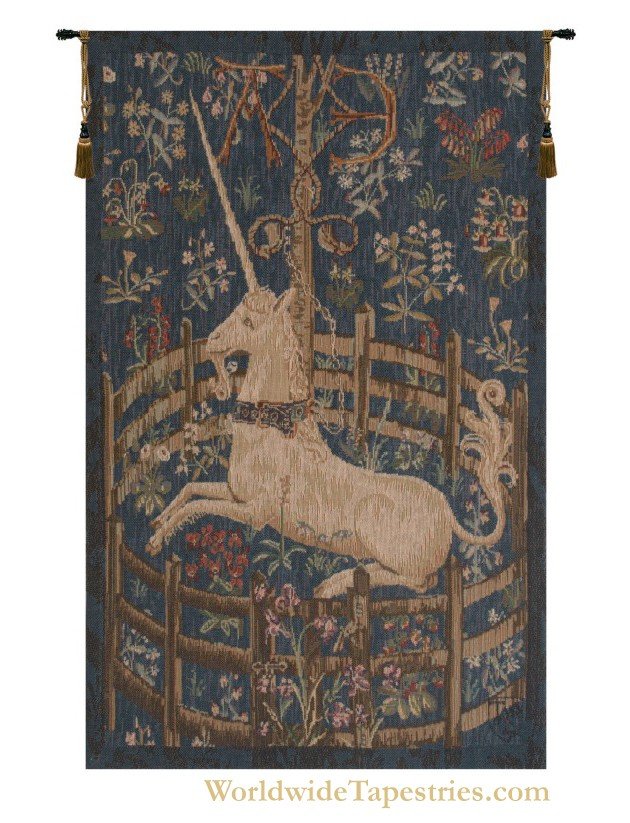
Find the location of a particular element. This screenshot has width=630, height=823. gold tassle is located at coordinates (545, 156), (82, 151).